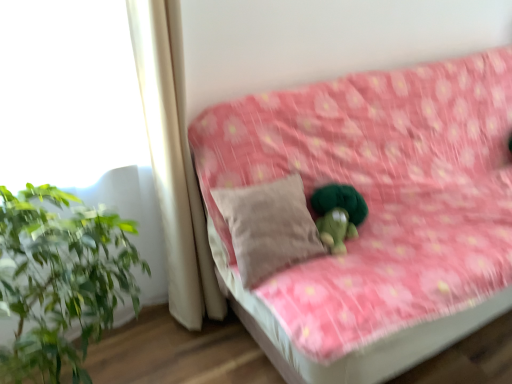
Question: Can you confirm if white fabric curtain at left is thinner than pink floral fabric couch at center?

Choices:
 (A) yes
 (B) no

Answer: (A)

Question: Does white fabric curtain at left have a greater height compared to pink floral fabric couch at center?

Choices:
 (A) no
 (B) yes

Answer: (B)

Question: Is white fabric curtain at left further to camera compared to pink floral fabric couch at center?

Choices:
 (A) yes
 (B) no

Answer: (A)

Question: Can you confirm if white fabric curtain at left is bigger than pink floral fabric couch at center?

Choices:
 (A) no
 (B) yes

Answer: (A)

Question: Considering the relative positions of white fabric curtain at left and pink floral fabric couch at center in the image provided, is white fabric curtain at left to the right of pink floral fabric couch at center from the viewer's perspective?

Choices:
 (A) no
 (B) yes

Answer: (A)

Question: Is white fabric curtain at left in front of or behind pink floral fabric couch at center in the image?

Choices:
 (A) front
 (B) behind

Answer: (B)

Question: Considering the positions of white fabric curtain at left and pink floral fabric couch at center in the image, is white fabric curtain at left taller or shorter than pink floral fabric couch at center?

Choices:
 (A) short
 (B) tall

Answer: (B)

Question: Would you say white fabric curtain at left is to the left or to the right of pink floral fabric couch at center in the picture?

Choices:
 (A) left
 (B) right

Answer: (A)

Question: From a real-world perspective, is white fabric curtain at left positioned above or below pink floral fabric couch at center?

Choices:
 (A) above
 (B) below

Answer: (A)

Question: From the image's perspective, is beige fabric pillow at center positioned above or below white fabric curtain at left?

Choices:
 (A) below
 (B) above

Answer: (A)

Question: From their relative heights in the image, would you say beige fabric pillow at center is taller or shorter than white fabric curtain at left?

Choices:
 (A) short
 (B) tall

Answer: (A)

Question: Considering the positions of point coord(273,231) and point coord(175,125), is point coord(273,231) closer or farther from the camera than point coord(175,125)?

Choices:
 (A) farther
 (B) closer

Answer: (B)

Question: Based on their sizes in the image, would you say beige fabric pillow at center is bigger or smaller than white fabric curtain at left?

Choices:
 (A) small
 (B) big

Answer: (A)

Question: Considering the positions of white fabric curtain at left and beige fabric pillow at center in the image, is white fabric curtain at left wider or thinner than beige fabric pillow at center?

Choices:
 (A) wide
 (B) thin

Answer: (B)

Question: From the image's perspective, relative to beige fabric pillow at center, is white fabric curtain at left above or below?

Choices:
 (A) above
 (B) below

Answer: (A)